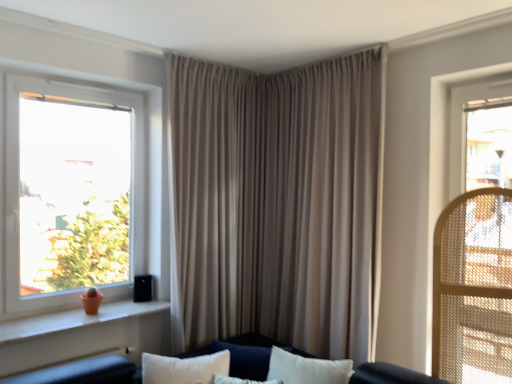
Question: From the image's perspective, is velvet dark blue couch at center above or below orange clay pot at left?

Choices:
 (A) below
 (B) above

Answer: (A)

Question: Considering the positions of velvet dark blue couch at center and orange clay pot at left in the image, is velvet dark blue couch at center wider or thinner than orange clay pot at left?

Choices:
 (A) wide
 (B) thin

Answer: (A)

Question: Considering the real-world distances, which object is closest to the white plastic window at left?

Choices:
 (A) beige fabric curtain at center
 (B) velvet dark blue couch at center
 (C) orange clay pot at left

Answer: (C)

Question: Estimate the real-world distances between objects in this image. Which object is farther from the orange clay pot at left?

Choices:
 (A) beige fabric curtain at center
 (B) white plastic window at left
 (C) velvet dark blue couch at center

Answer: (A)